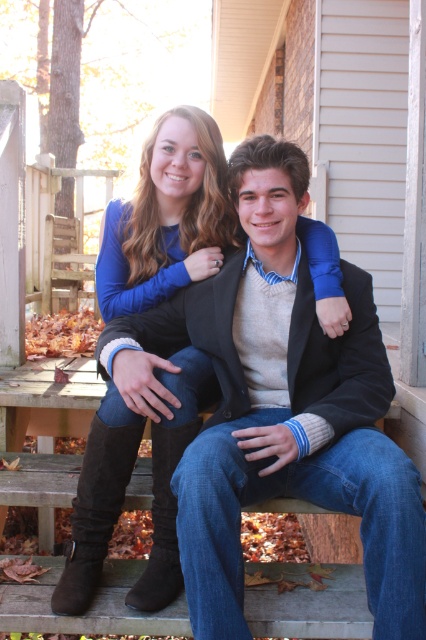
Question: Among these points, which one is nearest to the camera?

Choices:
 (A) (169, 518)
 (B) (158, 557)

Answer: (B)

Question: Which object is closer to the camera taking this photo?

Choices:
 (A) suede boot at lower left
 (B) brown suede boot at lower left

Answer: (B)

Question: Does suede boots at lower left appear over brown suede boot at lower left?

Choices:
 (A) no
 (B) yes

Answer: (B)

Question: Considering the real-world distances, which object is farthest from the brown suede boot at lower left?

Choices:
 (A) suede boot at lower left
 (B) suede boots at lower left

Answer: (B)

Question: Is suede boots at lower left wider than brown suede boot at lower left?

Choices:
 (A) yes
 (B) no

Answer: (A)

Question: Where is suede boots at lower left located in relation to brown suede boot at lower left in the image?

Choices:
 (A) right
 (B) left

Answer: (A)